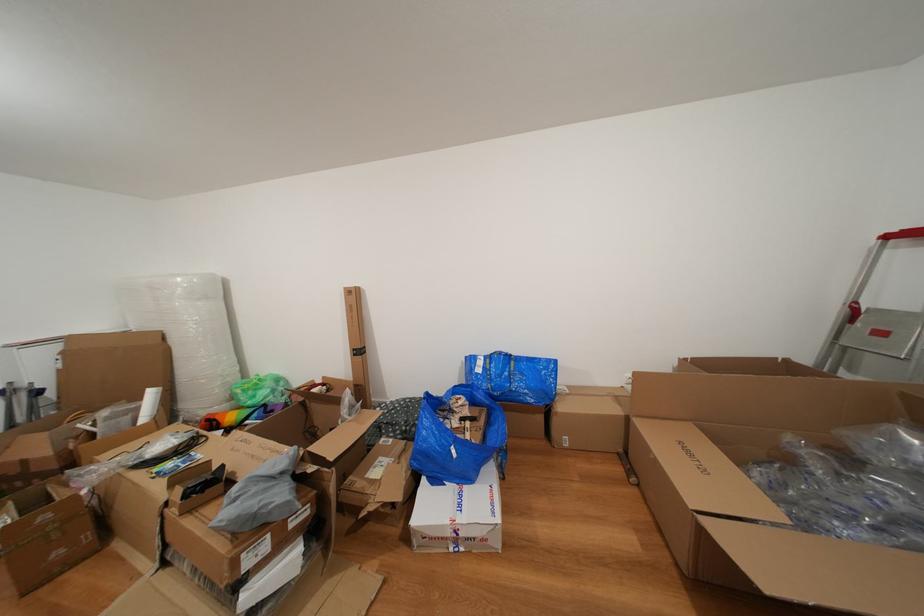
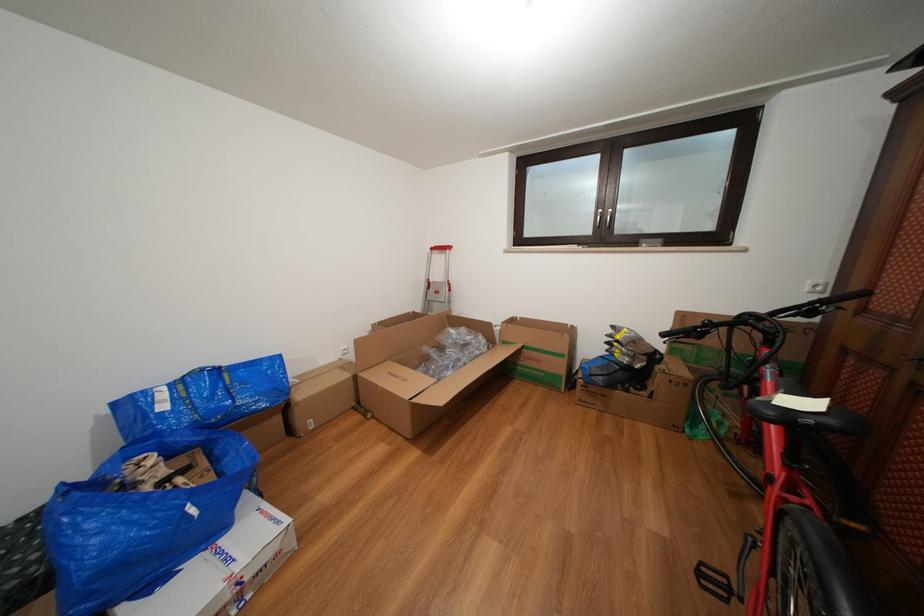
Find the pixel in the second image that matches (x=435, y=399) in the first image.

(71, 490)